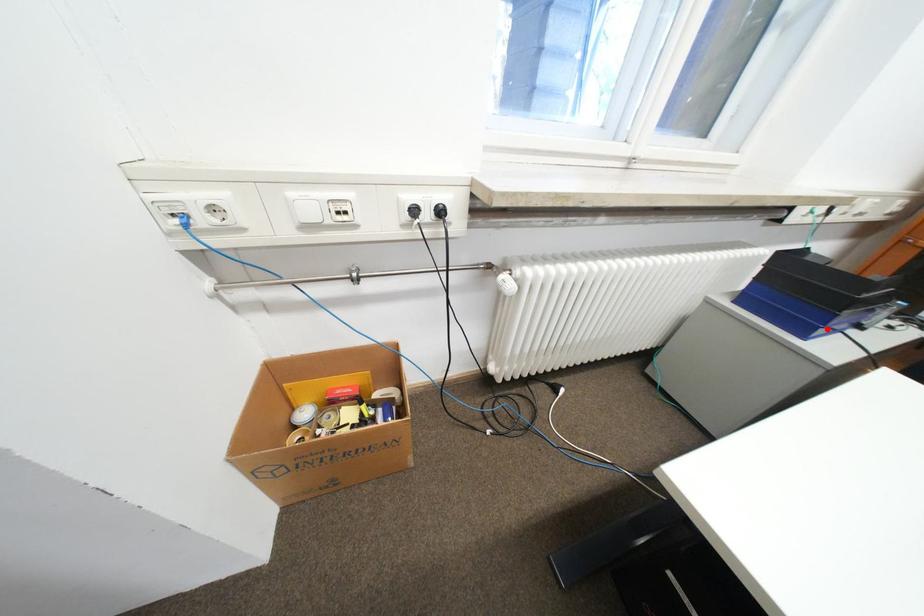
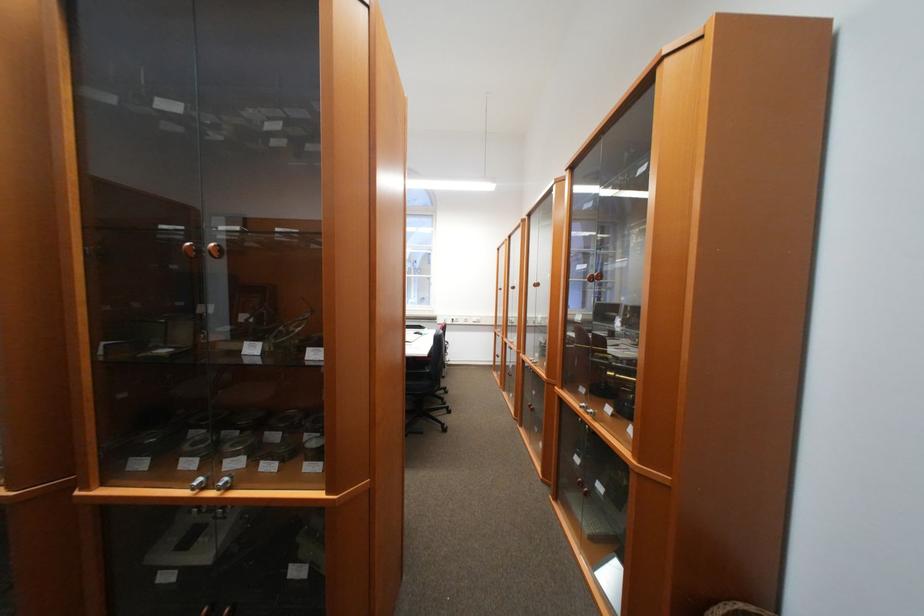
Question: I am providing you with two images of the same scene from different viewpoints. A red point is marked on the first image. Can you still see the location of the red point in image 2?

Choices:
 (A) Yes
 (B) No

Answer: (B)